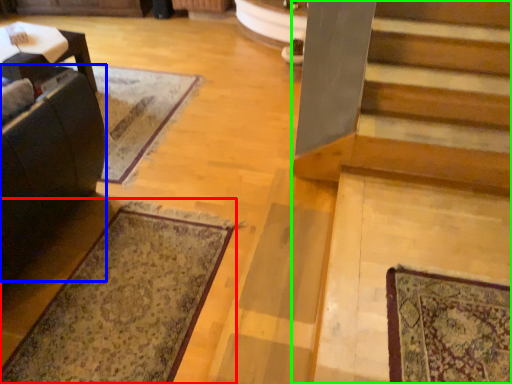
Question: Estimate the real-world distances between objects in this image. Which object is farther from mat (highlighted by a red box), rocking chair (highlighted by a blue box) or stairs (highlighted by a green box)?

Choices:
 (A) rocking chair
 (B) stairs

Answer: (B)